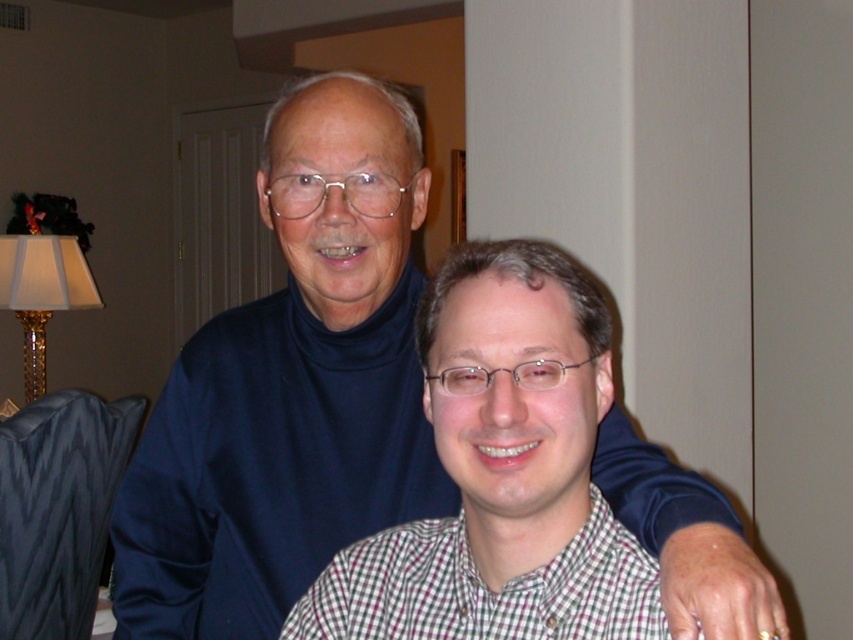
You are standing in the room where the two people are seated. There is a point at coordinates [289,388]. What object is located at that point?

The point at coordinates [289,388] indicates the dark blue turtleneck sweater at upper center.

You are a photographer setting up a portrait shot. You have two subjects wearing the dark blue turtleneck sweater at upper center and the checkered shirt at center. Since you want to ensure both subjects are in proper focus, you need to know which subject is taller. Can you determine which one is taller?

The dark blue turtleneck sweater at upper center is much taller than the checkered shirt at center, so the subject wearing the dark blue turtleneck sweater at upper center is taller.